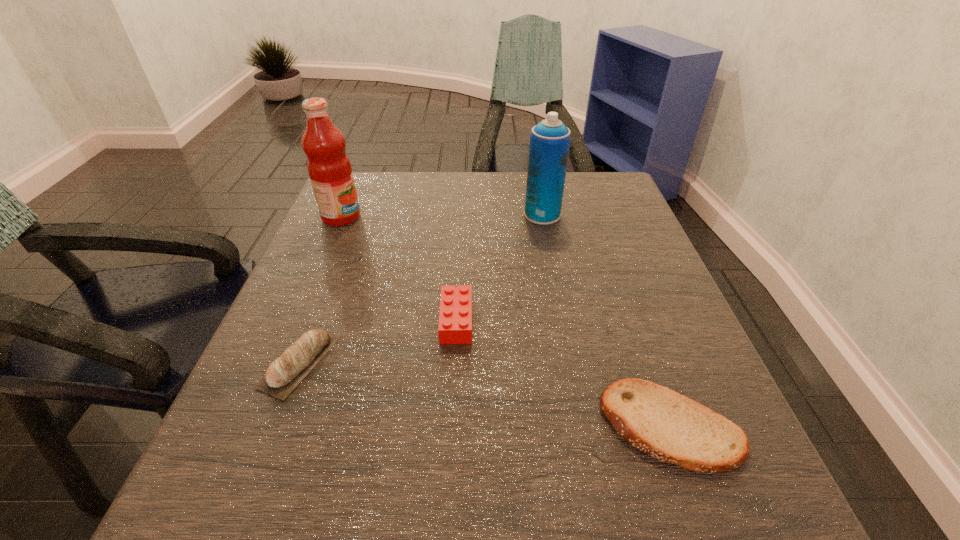
Where is `fruit juice`? fruit juice is located at coordinates 329,168.

At what (x,y) coordinates should I click in order to perform the action: click on aerosol can. Please return your answer as a coordinate pair (x, y). Image resolution: width=960 pixels, height=540 pixels. Looking at the image, I should click on (550, 139).

Where is `Lego`? The width and height of the screenshot is (960, 540). Lego is located at coordinates [x=455, y=318].

In order to click on the left pita bread in this screenshot , I will do `click(281, 378)`.

At what (x,y) coordinates should I click in order to perform the action: click on the right pita bread. Please return your answer as a coordinate pair (x, y). This screenshot has width=960, height=540. Looking at the image, I should click on (668, 426).

I want to click on free space located 0.150m on the front label of the fruit juice, so click(423, 217).

Find the location of a particular element. vacant point located 0.370m on the front of the aerosol can is located at coordinates (568, 349).

The height and width of the screenshot is (540, 960). Identify the location of vacant space located on the right of the third object from left to right. (544, 320).

What are the coordinates of `vacant region located on the right of the left pita bread` in the screenshot? It's located at (443, 361).

Locate an element on the screen. The height and width of the screenshot is (540, 960). free space located 0.360m on the left of the right pita bread is located at coordinates (355, 426).